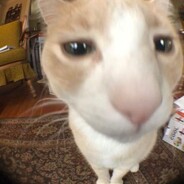
This screenshot has width=184, height=184. I want to click on dark orange wooden floor, so click(24, 105).